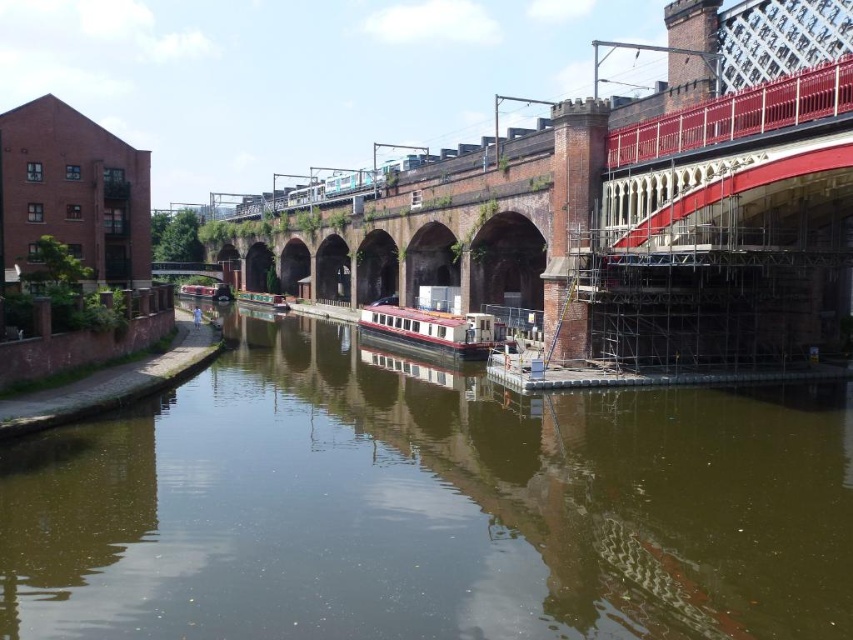
Question: Is green reflective water at center closer to the viewer compared to brick red bridge at upper center?

Choices:
 (A) yes
 (B) no

Answer: (A)

Question: Does green reflective water at center appear on the right side of matte red houseboat at center?

Choices:
 (A) no
 (B) yes

Answer: (B)

Question: Which object is farther from the camera taking this photo?

Choices:
 (A) brick red bridge at upper center
 (B) green reflective water at center

Answer: (A)

Question: Which point appears closest to the camera in this image?

Choices:
 (A) (373, 330)
 (B) (387, 604)
 (C) (538, 298)

Answer: (B)

Question: Observing the image, what is the correct spatial positioning of brick red bridge at upper center in reference to matte red houseboat at center?

Choices:
 (A) below
 (B) above

Answer: (B)

Question: Which point is closer to the camera?

Choices:
 (A) brick red bridge at upper center
 (B) matte red houseboat at center

Answer: (A)